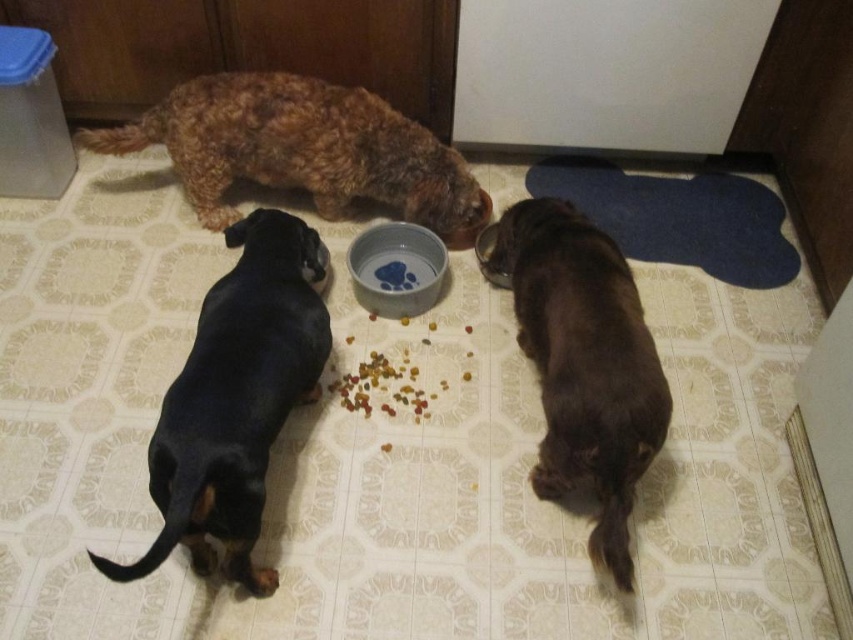
Question: Which of these objects is positioned farthest from the fuzzy brown dog at upper left?

Choices:
 (A) metallic silver bowl at center
 (B) black smooth dachshund at lower left
 (C) brown furry dog at lower right
 (D) blue glossy bowl at center

Answer: (C)

Question: In this image, where is black smooth dachshund at lower left located relative to metallic silver bowl at center?

Choices:
 (A) below
 (B) above

Answer: (A)

Question: Which object is closer to the camera taking this photo?

Choices:
 (A) metallic silver bowl at center
 (B) blue glossy bowl at center
 (C) black smooth dachshund at lower left
 (D) brown furry dog at lower right

Answer: (C)

Question: Is black smooth dachshund at lower left to the left of fuzzy brown dog at upper left from the viewer's perspective?

Choices:
 (A) yes
 (B) no

Answer: (B)

Question: Which object is farther from the camera taking this photo?

Choices:
 (A) blue glossy bowl at center
 (B) metallic silver bowl at center

Answer: (B)

Question: Is fuzzy brown dog at upper left closer to the viewer compared to metallic silver bowl at center?

Choices:
 (A) no
 (B) yes

Answer: (B)